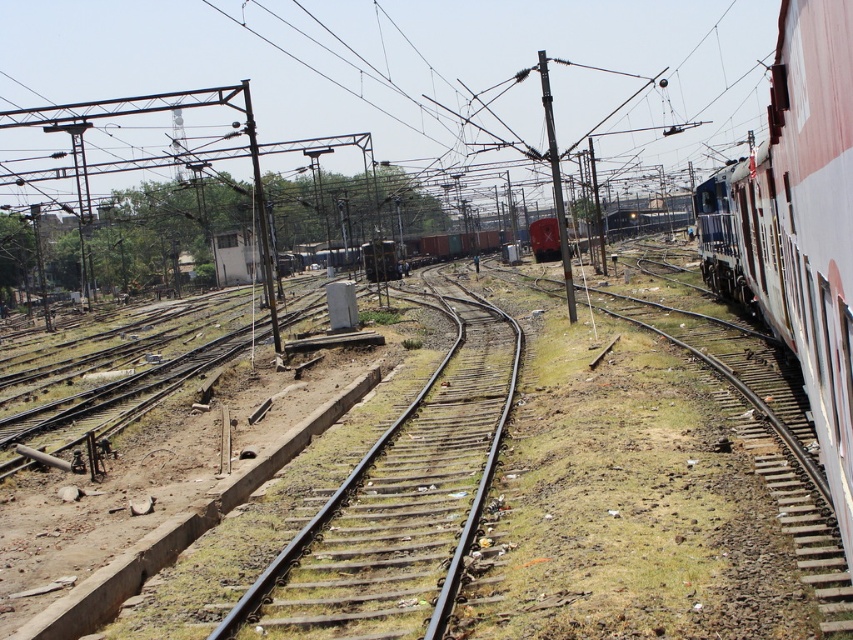
Question: Is smooth metal train track at center wider than white glossy train at right?

Choices:
 (A) no
 (B) yes

Answer: (A)

Question: Can you confirm if smooth metal train track at center is smaller than white glossy train at right?

Choices:
 (A) no
 (B) yes

Answer: (B)

Question: Can you confirm if smooth metal train track at center is positioned above white glossy train at right?

Choices:
 (A) yes
 (B) no

Answer: (B)

Question: Which object is closer to the camera taking this photo?

Choices:
 (A) white glossy train at right
 (B) smooth metal train track at center

Answer: (A)

Question: Which object is farther from the camera taking this photo?

Choices:
 (A) white glossy train at right
 (B) smooth metal train track at center

Answer: (B)